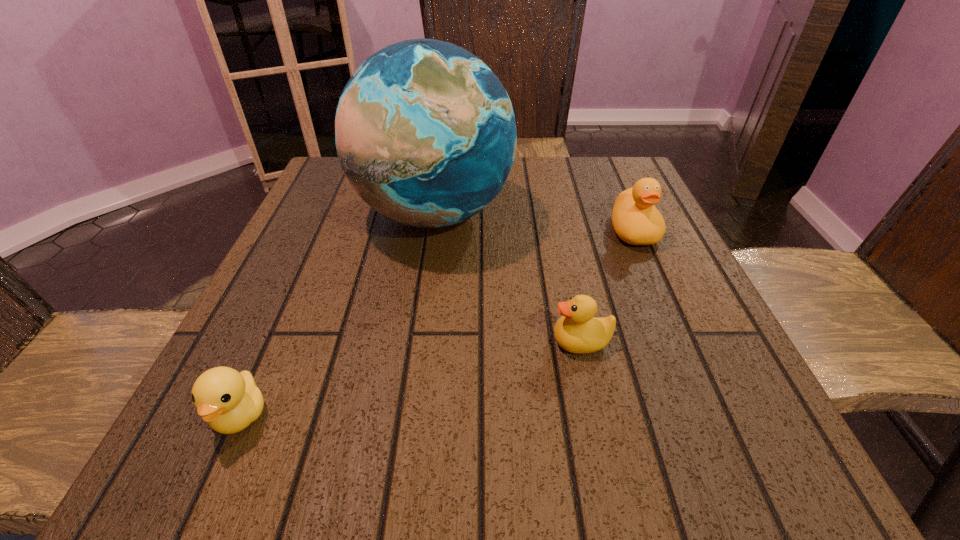
Locate an element on the screen. This screenshot has height=540, width=960. vacant space at the far edge of the desktop is located at coordinates (546, 178).

In the image, there is a desktop. Where is `vacant space at the near edge`? vacant space at the near edge is located at coordinates (328, 471).

I want to click on vacant region at the left edge of the desktop, so click(x=345, y=210).

Where is `free space at the right edge`? free space at the right edge is located at coordinates (645, 341).

In order to click on free space at the far left corner in this screenshot , I will do `click(349, 192)`.

This screenshot has width=960, height=540. Identify the location of vacant space at the far right corner of the desktop. (577, 158).

I want to click on vacant space that's between the nearest duck and the second nearest object, so click(x=411, y=378).

Locate an element on the screen. vacant area between the second object from right to left and the tallest object is located at coordinates (508, 278).

Where is `free spot between the rightmost object and the third farthest object`? free spot between the rightmost object and the third farthest object is located at coordinates (608, 286).

Locate an element on the screen. The height and width of the screenshot is (540, 960). free area in between the leftmost object and the second duck from right to left is located at coordinates (411, 378).